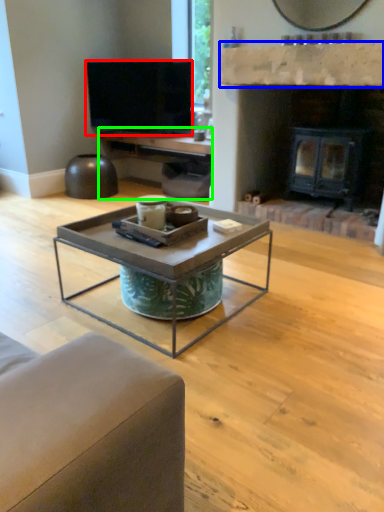
Question: Estimate the real-world distances between objects in this image. Which object is farther from television (highlighted by a red box), mantle (highlighted by a blue box) or entertainment center (highlighted by a green box)?

Choices:
 (A) mantle
 (B) entertainment center

Answer: (A)